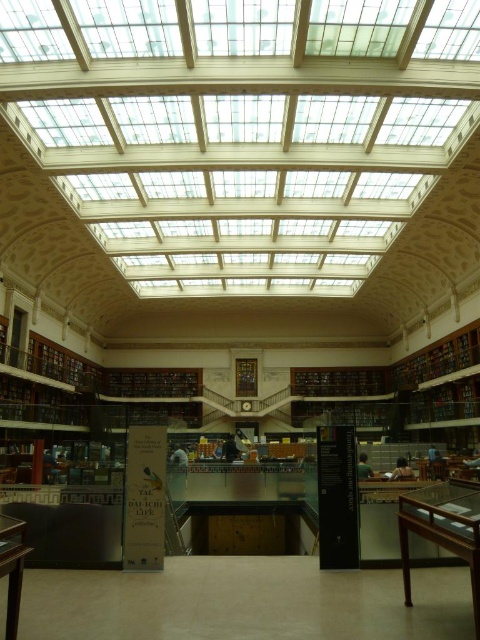
Is wooden table at lower right taller than wooden table at lower left?

Correct, wooden table at lower right is much taller as wooden table at lower left.

Is wooden table at lower right positioned in front of wooden table at lower left?

That is True.

This screenshot has height=640, width=480. Identify the location of wooden table at lower right. (443, 529).

You are a GUI agent. You are given a task and a screenshot of the screen. Output one action in this format:
    pyautogui.click(x=<x>, y=<y>)
    Task: Click on the wooden table at lower right
    The height and width of the screenshot is (640, 480).
    Given the screenshot: What is the action you would take?
    pyautogui.click(x=443, y=529)